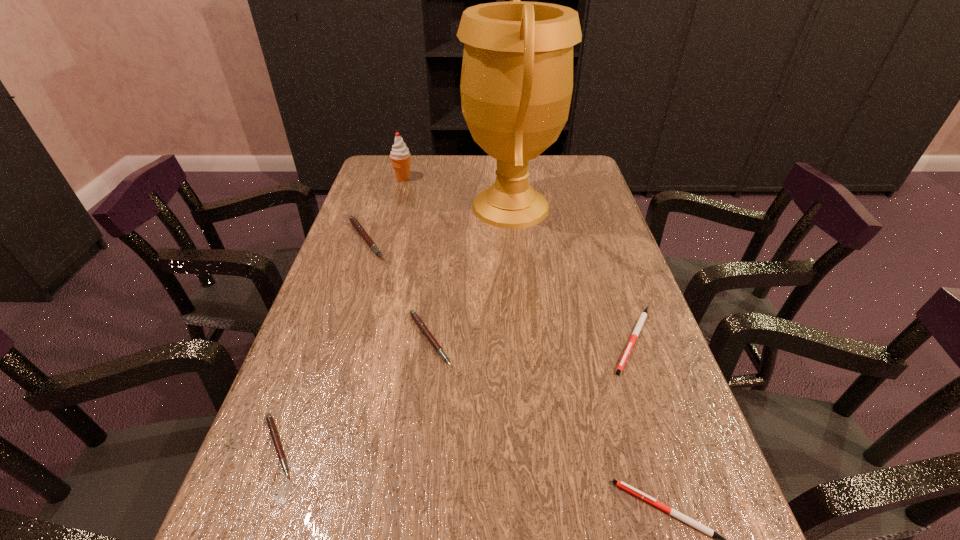
The height and width of the screenshot is (540, 960). In order to click on pink pen identified as the closest to the red icecream in this screenshot , I will do `click(353, 220)`.

Identify which white pen is located as the second nearest to the tallest object. Please provide its 2D coordinates. Your answer should be formatted as a tuple, i.e. [(x, y)], where the tuple contains the x and y coordinates of a point satisfying the conditions above.

[(624, 486)]

Identify which white pen is the closest to the third tallest object. Please provide its 2D coordinates. Your answer should be formatted as a tuple, i.e. [(x, y)], where the tuple contains the x and y coordinates of a point satisfying the conditions above.

[(637, 329)]